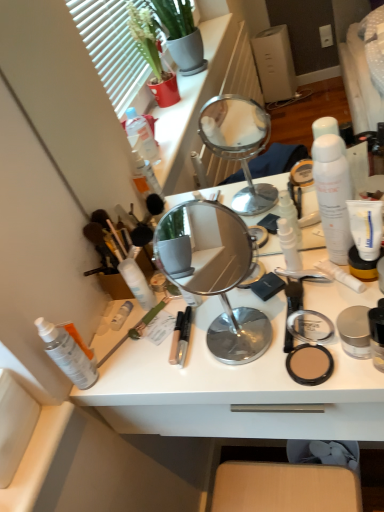
You are a GUI agent. You are given a task and a screenshot of the screen. Output one action in this format:
    pyautogui.click(x=<x>, y=<y>)
    Task: Click on the free space to the back side of polished silver mirror at center
    The image size is (384, 512).
    Given the screenshot: What is the action you would take?
    pyautogui.click(x=215, y=300)